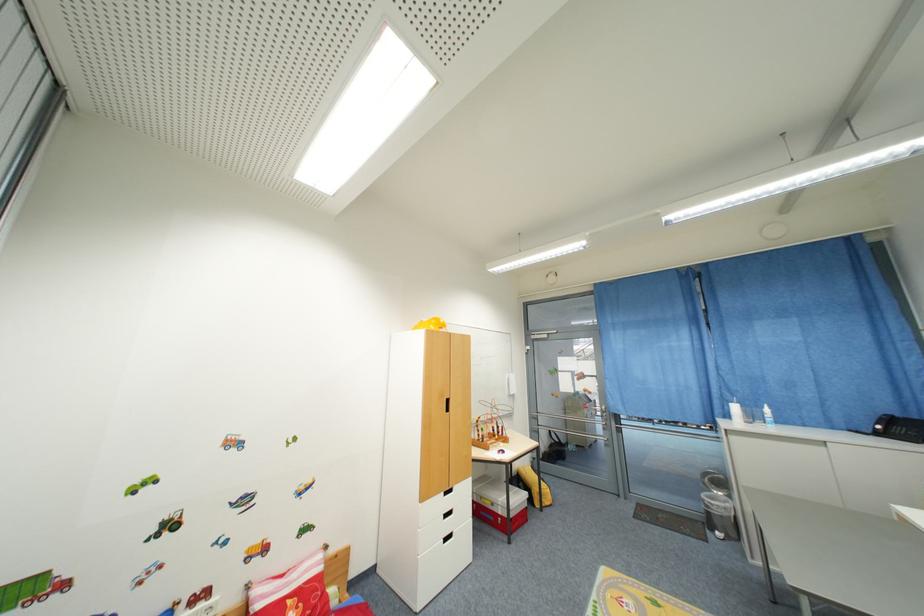
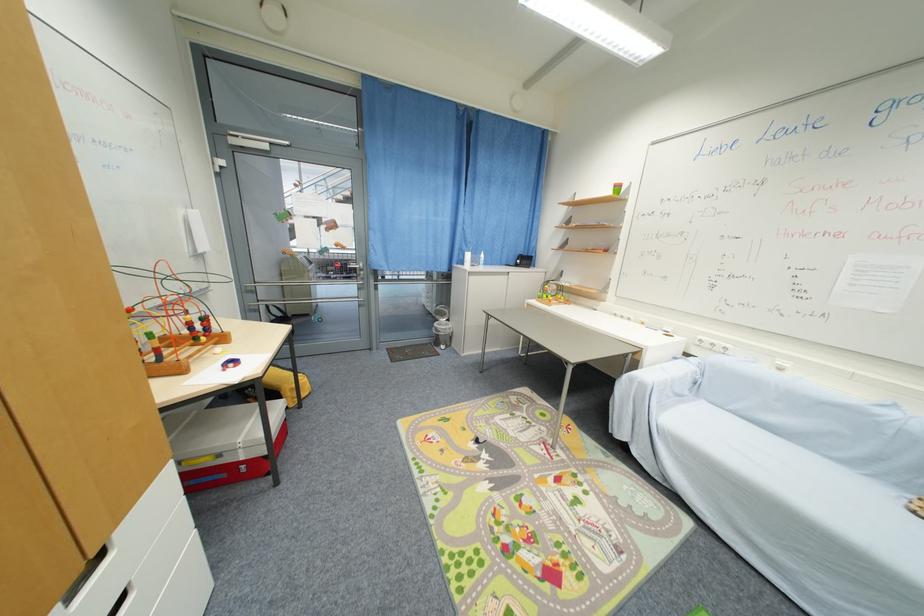
Locate, in the second image, the point that corresponds to pixel 500 438 in the first image.

(201, 341)